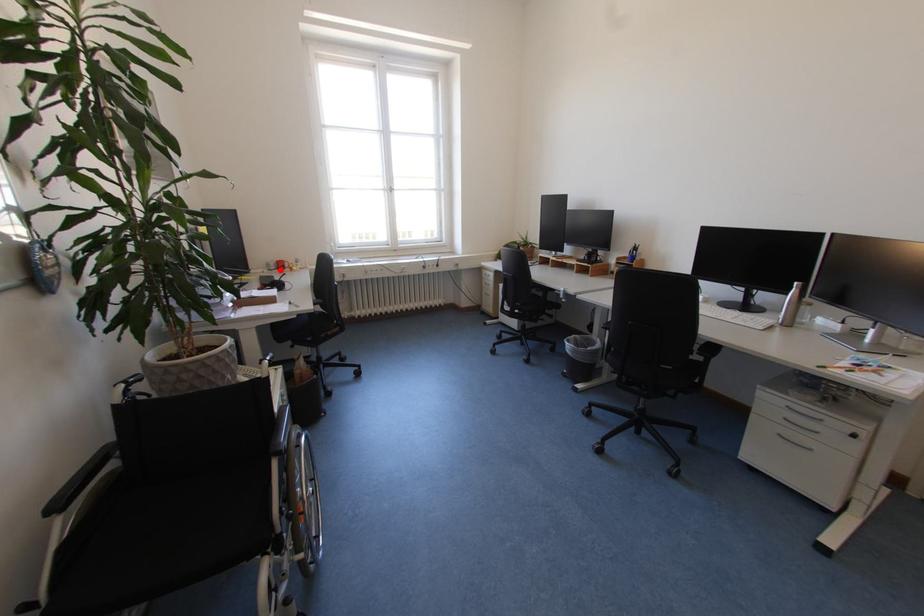
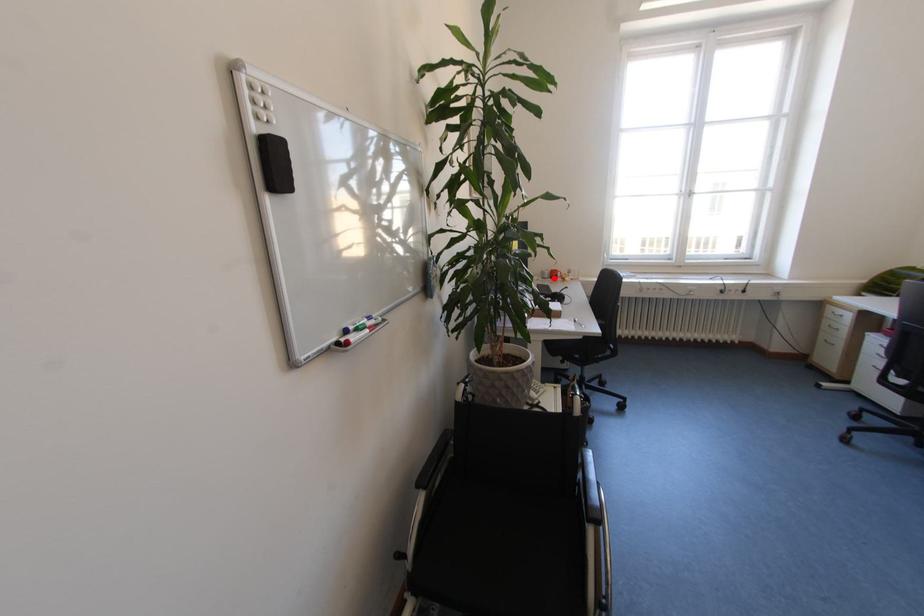
I am providing you with two images of the same scene from different viewpoints. A red point is marked on the first image and another point is marked on the second image. Do the highlighted points in image1 and image2 indicate the same real-world spot?

Yes